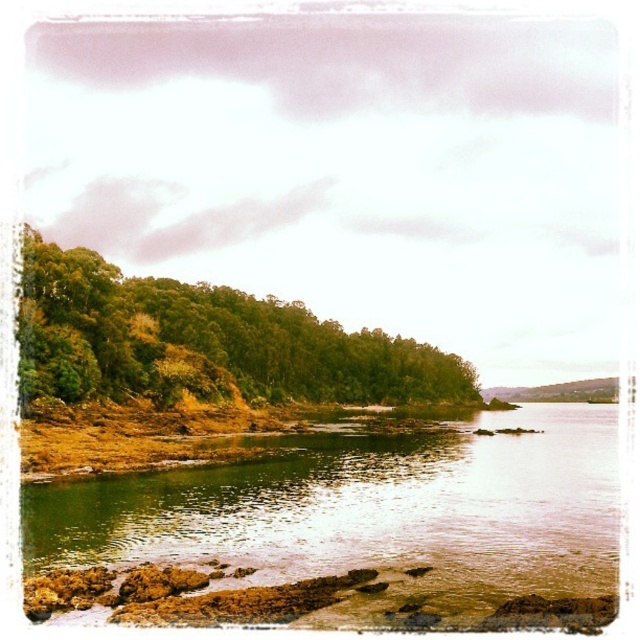
Is green mossy rocks at lower left wider than green leafy trees at left?

No, green mossy rocks at lower left is not wider than green leafy trees at left.

At what (x,y) coordinates should I click in order to perform the action: click on green mossy rocks at lower left. Please return your answer as a coordinate pair (x, y). Image resolution: width=640 pixels, height=640 pixels. Looking at the image, I should click on (369, 513).